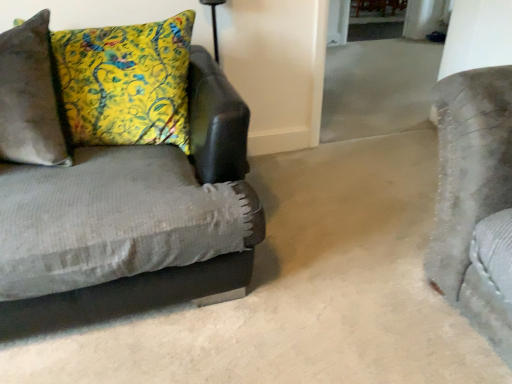
Question: Does yellow floral pillow at left have a larger size compared to velvet gray couch at left?

Choices:
 (A) yes
 (B) no

Answer: (B)

Question: Is there a large distance between yellow floral pillow at left and velvet gray couch at left?

Choices:
 (A) no
 (B) yes

Answer: (A)

Question: Can you confirm if yellow floral pillow at left is positioned to the left of velvet gray couch at left?

Choices:
 (A) no
 (B) yes

Answer: (B)

Question: Is yellow floral pillow at left facing towards velvet gray couch at left?

Choices:
 (A) no
 (B) yes

Answer: (B)

Question: Would you say velvet gray couch at left is part of yellow floral pillow at left's contents?

Choices:
 (A) no
 (B) yes

Answer: (A)

Question: Does yellow floral pillow at left have a lesser width compared to velvet gray couch at left?

Choices:
 (A) yes
 (B) no

Answer: (A)

Question: From the image's perspective, is velvet gray couch at left located beneath yellow floral pillow at left?

Choices:
 (A) no
 (B) yes

Answer: (B)

Question: Can you confirm if velvet gray couch at left is thinner than yellow floral pillow at left?

Choices:
 (A) no
 (B) yes

Answer: (A)

Question: Can you confirm if velvet gray couch at left is positioned to the left of yellow floral pillow at left?

Choices:
 (A) no
 (B) yes

Answer: (A)

Question: Is velvet gray couch at left smaller than yellow floral pillow at left?

Choices:
 (A) yes
 (B) no

Answer: (B)

Question: Does velvet gray couch at left have a larger size compared to yellow floral pillow at left?

Choices:
 (A) yes
 (B) no

Answer: (A)

Question: Considering the relative sizes of velvet gray couch at left and yellow floral pillow at left in the image provided, is velvet gray couch at left shorter than yellow floral pillow at left?

Choices:
 (A) yes
 (B) no

Answer: (B)

Question: Is point (184, 215) positioned closer to the camera than point (128, 82)?

Choices:
 (A) farther
 (B) closer

Answer: (B)